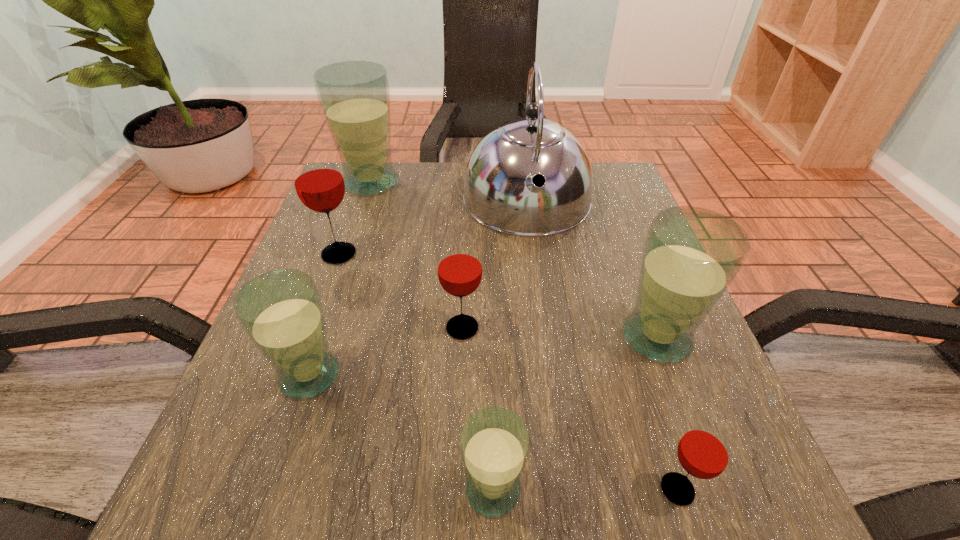
Where is `vacant space at the near left corner of the desktop`? This screenshot has height=540, width=960. vacant space at the near left corner of the desktop is located at coordinates (224, 480).

This screenshot has height=540, width=960. In the image, there is a desktop. In order to click on vacant space at the far right corner in this screenshot , I will do click(x=625, y=195).

Identify the location of free space between the nearest red glass and the second red glass from right to left. The image size is (960, 540). (570, 409).

Locate an element on the screen. vacant area that lies between the farthest blue glass and the second smallest blue glass is located at coordinates (340, 279).

Find the location of a particular element. free space that is in between the biggest red glass and the biggest blue glass is located at coordinates (355, 218).

This screenshot has width=960, height=540. In order to click on empty space that is in between the biggest red glass and the smallest red glass in this screenshot , I will do pyautogui.click(x=508, y=372).

Find the location of a particular element. This screenshot has height=540, width=960. free area in between the second smallest blue glass and the biggest red glass is located at coordinates (324, 314).

Image resolution: width=960 pixels, height=540 pixels. What are the coordinates of `vacant space in between the rightmost blue glass and the smallest red glass` in the screenshot? It's located at (667, 414).

I want to click on empty space that is in between the kettle and the smallest red glass, so click(602, 346).

This screenshot has height=540, width=960. I want to click on vacant space in between the smallest red glass and the rightmost blue glass, so click(x=667, y=414).